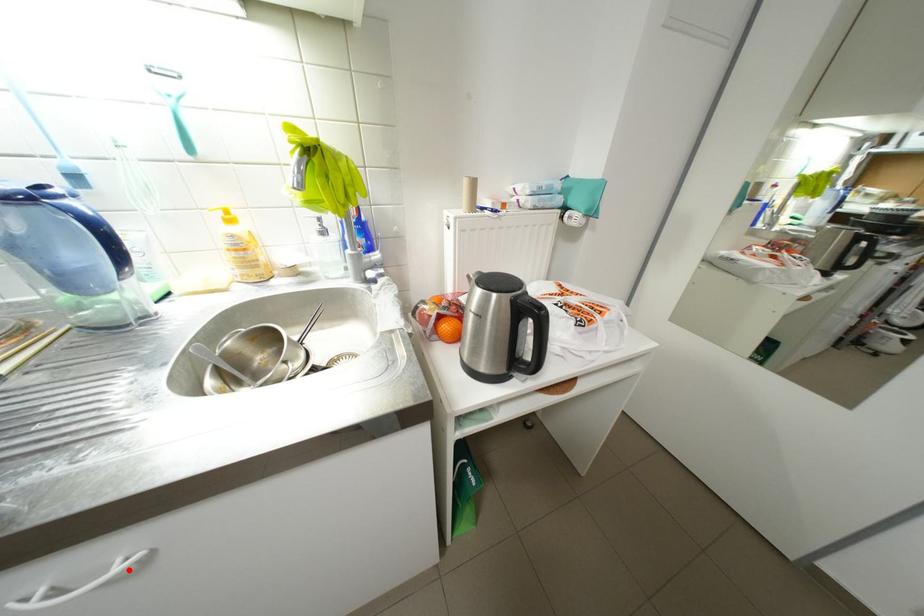
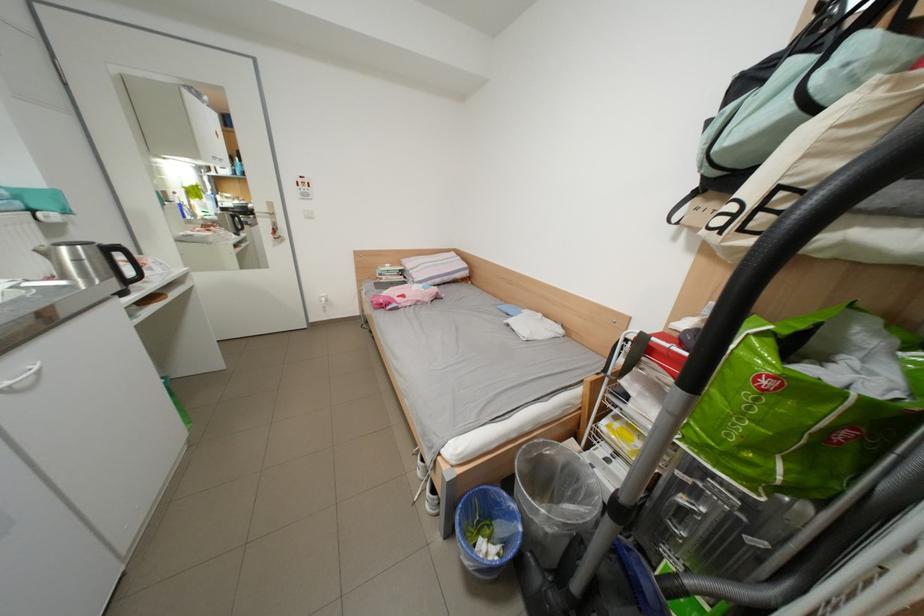
Where in the second image is the point corresponding to the highlighted location from the first image?

(46, 369)